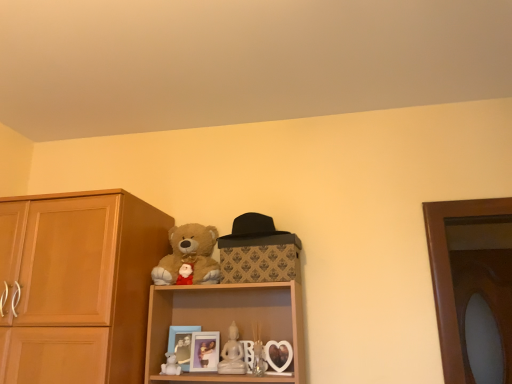
Locate an element on the screen. This screenshot has height=384, width=512. white matte teddy bear at lower center is located at coordinates (170, 365).

Measure the distance between point [200,354] and camera.

Point [200,354] is 5.84 feet from camera.

Measure the distance between light brown wood cabinet at left and camera.

1.46 meters.

Identify the location of white matte teddy bear at lower center. This screenshot has height=384, width=512. (170, 365).

Is white porcelain figurine at center positioned beyond the bounds of light brown wood cabinet at left?

Yes, white porcelain figurine at center is located beyond the bounds of light brown wood cabinet at left.

Is white porcelain figurine at center aimed at light brown wood cabinet at left?

No, white porcelain figurine at center is not aimed at light brown wood cabinet at left.

Considering the relative positions of white porcelain figurine at center and light brown wood cabinet at left in the image provided, is white porcelain figurine at center to the left of light brown wood cabinet at left from the viewer's perspective?

Incorrect, white porcelain figurine at center is not on the left side of light brown wood cabinet at left.

Who is taller, white matte teddy bear at lower center or soft plush teddy bear at upper center?

soft plush teddy bear at upper center is taller.

Consider the image. Measure the distance between white matte teddy bear at lower center and soft plush teddy bear at upper center.

white matte teddy bear at lower center is 15.82 inches away from soft plush teddy bear at upper center.

Would you say white matte teddy bear at lower center is a long distance from soft plush teddy bear at upper center?

They are positioned close to each other.

Based on the photo, between white matte teddy bear at lower center and soft plush teddy bear at upper center, which one has larger width?

soft plush teddy bear at upper center.

From the image's perspective, is white porcelain figurine at center above or below matte blue picture frame at lower center, the first picture frame in the left-to-right sequence?

From the image's perspective, white porcelain figurine at center appears above matte blue picture frame at lower center, the first picture frame in the left-to-right sequence.

Can you confirm if white porcelain figurine at center is wider than matte blue picture frame at lower center, the first picture frame in the left-to-right sequence?

In fact, white porcelain figurine at center might be narrower than matte blue picture frame at lower center, the first picture frame in the left-to-right sequence.

Is matte blue picture frame at lower center, which appears as the 2th picture frame when viewed from the right, a part of white porcelain figurine at center?

Actually, matte blue picture frame at lower center, which appears as the 2th picture frame when viewed from the right, is outside white porcelain figurine at center.

Can you tell me how much white porcelain figurine at center and matte blue picture frame at lower center, the first picture frame in the left-to-right sequence, differ in facing direction?

white porcelain figurine at center and matte blue picture frame at lower center, the first picture frame in the left-to-right sequence, are facing 18.3 degrees away from each other.

Is white matte teddy bear at lower center bigger than matte blue picture frame at lower center, which appears as the 2th picture frame when viewed from the right?

No, white matte teddy bear at lower center is not bigger than matte blue picture frame at lower center, which appears as the 2th picture frame when viewed from the right.

Which object is positioned more to the left, white matte teddy bear at lower center or matte blue picture frame at lower center, which appears as the 2th picture frame when viewed from the right?

From the viewer's perspective, white matte teddy bear at lower center appears more on the left side.

Could you measure the distance between white matte teddy bear at lower center and matte blue picture frame at lower center, the first picture frame in the left-to-right sequence?

white matte teddy bear at lower center and matte blue picture frame at lower center, the first picture frame in the left-to-right sequence, are 2.36 inches apart from each other.

Would you say matte blue picture frame at lower center, the first picture frame in the left-to-right sequence, is part of white matte teddy bear at lower center's contents?

That's incorrect, matte blue picture frame at lower center, the first picture frame in the left-to-right sequence, is not inside white matte teddy bear at lower center.

Which is in front, point (212, 232) or point (82, 225)?

The point (82, 225) is more forward.

Do you think soft plush teddy bear at upper center is within light brown wood cabinet at left, or outside of it?

soft plush teddy bear at upper center is located beyond the bounds of light brown wood cabinet at left.

Consider the image. Can you confirm if soft plush teddy bear at upper center is positioned to the right of light brown wood cabinet at left?

Yes, soft plush teddy bear at upper center is to the right of light brown wood cabinet at left.

Can you confirm if soft plush teddy bear at upper center is thinner than light brown wood cabinet at left?

Yes.

How many degrees apart are the facing directions of soft plush teddy bear at upper center and matte blue picture frame at lower center, the first picture frame in the left-to-right sequence?

20.2 degrees.

Would you consider soft plush teddy bear at upper center to be distant from matte blue picture frame at lower center, which appears as the 2th picture frame when viewed from the right?

No.

I want to click on teddy bear above the matte blue picture frame at lower center, which appears as the 2th picture frame when viewed from the right (from the image's perspective), so click(189, 257).

Is soft plush teddy bear at upper center at the right side of matte blue picture frame at lower center, which appears as the 2th picture frame when viewed from the right?

Correct, you'll find soft plush teddy bear at upper center to the right of matte blue picture frame at lower center, which appears as the 2th picture frame when viewed from the right.

Find the location of `toy in front of the white porcelain figurine at center`. toy in front of the white porcelain figurine at center is located at coordinates (170, 365).

Is white porcelain figurine at center at the back of white matte teddy bear at lower center?

No.

Is white matte teddy bear at lower center thinner than white porcelain figurine at center?

In fact, white matte teddy bear at lower center might be wider than white porcelain figurine at center.

Is white matte teddy bear at lower center beside white porcelain figurine at center?

No, white matte teddy bear at lower center is not making contact with white porcelain figurine at center.

You are a GUI agent. You are given a task and a screenshot of the screen. Output one action in this format:
    pyautogui.click(x=<x>, y=<y>)
    Task: Click on the cabinetry that appears above the white porcelain figurine at center (from a real-world perspective)
    The width and height of the screenshot is (512, 384).
    Given the screenshot: What is the action you would take?
    pyautogui.click(x=86, y=268)

In the image, there is a soft plush teddy bear at upper center. Identify the location of toy below it (from the image's perspective). (170, 365).

Considering their positions, is soft plush teddy bear at upper center positioned closer to white porcelain figurine at center than light brown wood cabinet at left?

soft plush teddy bear at upper center lies closer to white porcelain figurine at center than the other object.

When comparing their distances from matte blue picture frame at lower center, the first picture frame in the left-to-right sequence, does transparent glass door at right or white matte teddy bear at lower center seem further?

Among the two, transparent glass door at right is located further to matte blue picture frame at lower center, the first picture frame in the left-to-right sequence.

When comparing their distances from white matte teddy bear at lower center, does white porcelain figurine at center or soft plush teddy bear at upper center seem further?

soft plush teddy bear at upper center lies further to white matte teddy bear at lower center than the other object.

From the picture: Considering their positions, is transparent glass door at right positioned further to matte plastic picture frame at center, the 2th picture frame from the left, than soft plush teddy bear at upper center?

Based on the image, transparent glass door at right appears to be further to matte plastic picture frame at center, the 2th picture frame from the left.

Based on their spatial positions, is white matte teddy bear at lower center or white porcelain figurine at center further from matte plastic picture frame at center, the first picture frame in the right-to-left sequence?

Based on the image, white matte teddy bear at lower center appears to be further to matte plastic picture frame at center, the first picture frame in the right-to-left sequence.

Based on their spatial positions, is transparent glass door at right or soft plush teddy bear at upper center closer to matte blue picture frame at lower center, the first picture frame in the left-to-right sequence?

The object closer to matte blue picture frame at lower center, the first picture frame in the left-to-right sequence, is soft plush teddy bear at upper center.

When comparing their distances from white matte teddy bear at lower center, does transparent glass door at right or matte blue picture frame at lower center, which appears as the 2th picture frame when viewed from the right, seem closer?

Based on the image, matte blue picture frame at lower center, which appears as the 2th picture frame when viewed from the right, appears to be nearer to white matte teddy bear at lower center.

Based on their spatial positions, is transparent glass door at right or matte blue picture frame at lower center, the first picture frame in the left-to-right sequence, further from soft plush teddy bear at upper center?

transparent glass door at right is further to soft plush teddy bear at upper center.

Find the location of `teddy bear between light brown wood cabinet at left and white porcelain figurine at center from left to right`. teddy bear between light brown wood cabinet at left and white porcelain figurine at center from left to right is located at coordinates (189, 257).

Find the location of a particular element. picture frame between matte blue picture frame at lower center, the first picture frame in the left-to-right sequence, and transparent glass door at right, in the horizontal direction is located at coordinates (204, 351).

Locate an element on the screen. figurine between light brown wood cabinet at left and transparent glass door at right in the horizontal direction is located at coordinates (232, 354).

Locate an element on the screen. The height and width of the screenshot is (384, 512). picture frame between light brown wood cabinet at left and soft plush teddy bear at upper center is located at coordinates (181, 344).